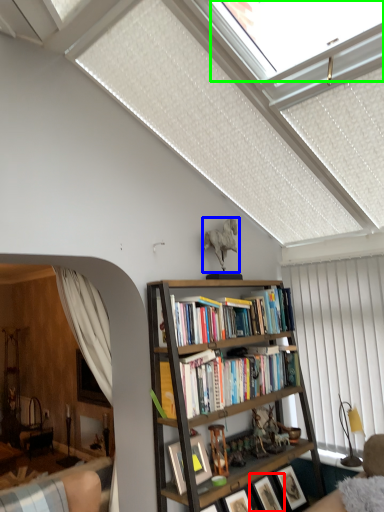
Question: Which object is positioned closest to picture frame (highlighted by a red box)? Select from toy (highlighted by a blue box) and window (highlighted by a green box).

Choices:
 (A) toy
 (B) window

Answer: (A)